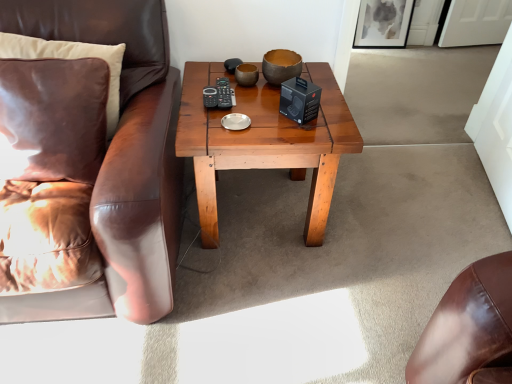
This screenshot has height=384, width=512. Identify the location of vacant region to the right of matte gray painting at upper right. (414, 56).